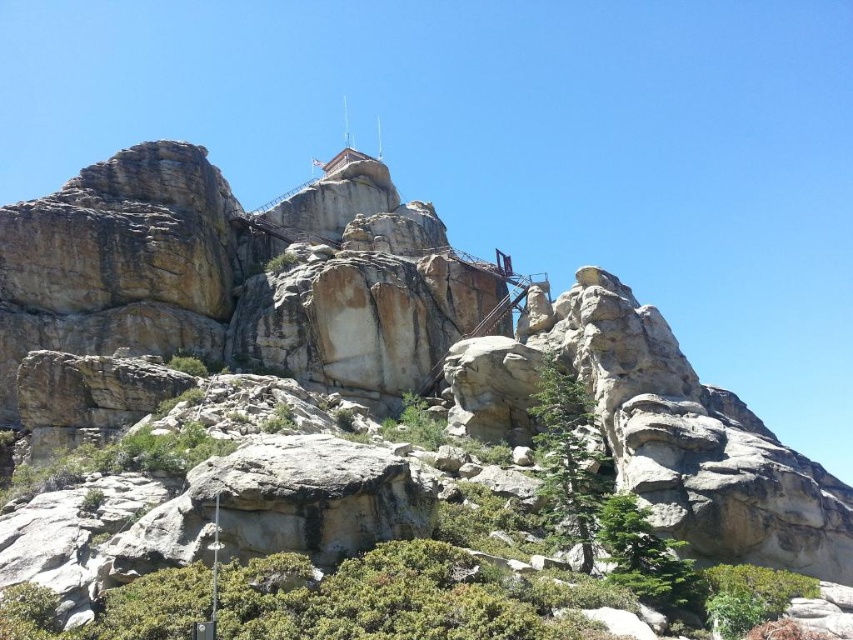
Question: Observing the image, what is the correct spatial positioning of green textured tree at center in reference to green leafy shrub at lower right?

Choices:
 (A) below
 (B) above

Answer: (B)

Question: Does green textured tree at center appear on the right side of green textured tree at lower center?

Choices:
 (A) no
 (B) yes

Answer: (A)

Question: Which point appears closest to the camera in this image?

Choices:
 (A) (544, 481)
 (B) (749, 586)
 (C) (608, 573)

Answer: (B)

Question: Can you confirm if green textured tree at center is positioned above green leafy shrub at lower right?

Choices:
 (A) no
 (B) yes

Answer: (B)

Question: Among these points, which one is farthest from the camera?

Choices:
 (A) (703, 573)
 (B) (560, 488)

Answer: (B)

Question: Which point is farther to the camera?

Choices:
 (A) (728, 568)
 (B) (543, 438)
 (C) (625, 572)

Answer: (B)